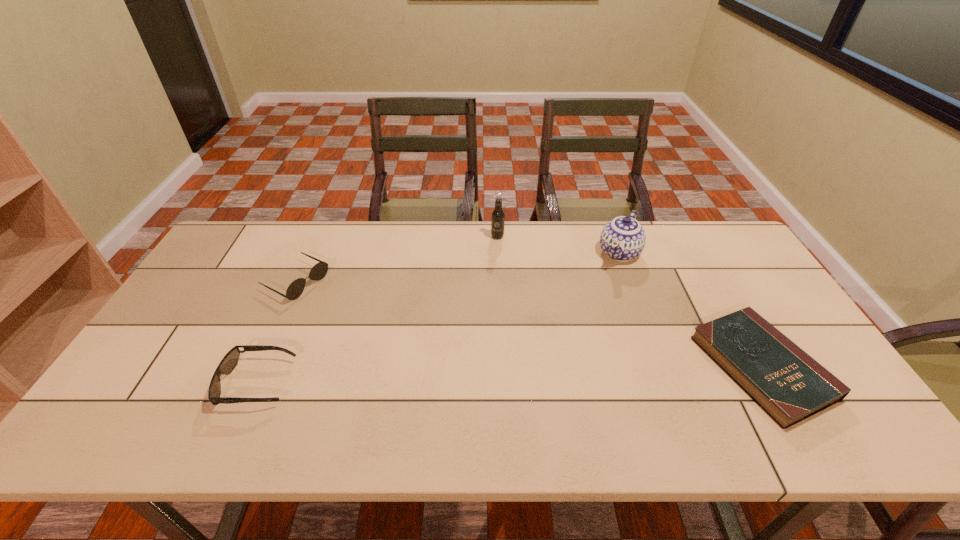
Find the location of a particular element. This screenshot has width=960, height=540. free space on the desktop that is between the shorter sunglasses and the shortest object and is positioned at the spout of the fourth object from left to right is located at coordinates (546, 374).

The width and height of the screenshot is (960, 540). Find the location of `free space on the desktop that is between the shorter sunglasses and the Bible and is positioned on the label of the tallest object`. free space on the desktop that is between the shorter sunglasses and the Bible and is positioned on the label of the tallest object is located at coordinates (496, 375).

This screenshot has height=540, width=960. I want to click on vacant space on the desktop that is between the second shortest object and the rightmost object and is positioned on the front-facing side of the farther sunglasses, so click(477, 376).